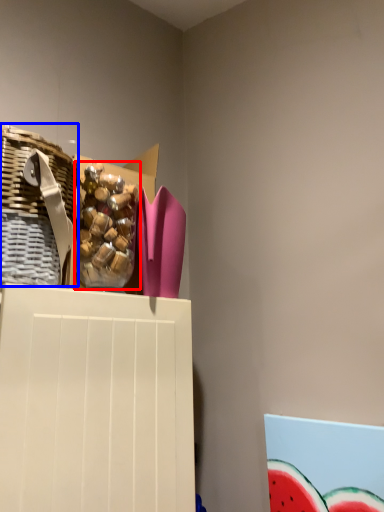
Question: Among these objects, which one is nearest to the camera, food (highlighted by a red box) or basket (highlighted by a blue box)?

Choices:
 (A) food
 (B) basket

Answer: (B)